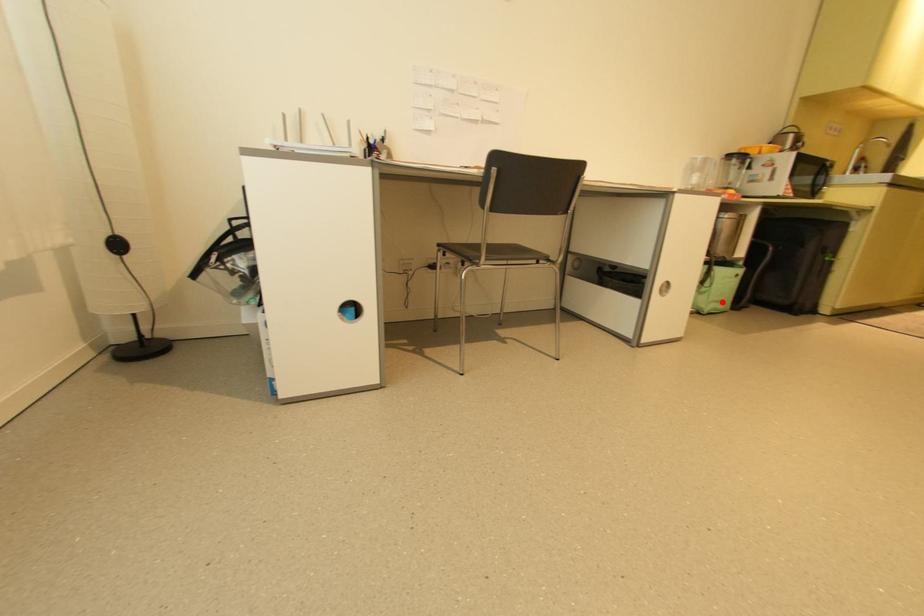
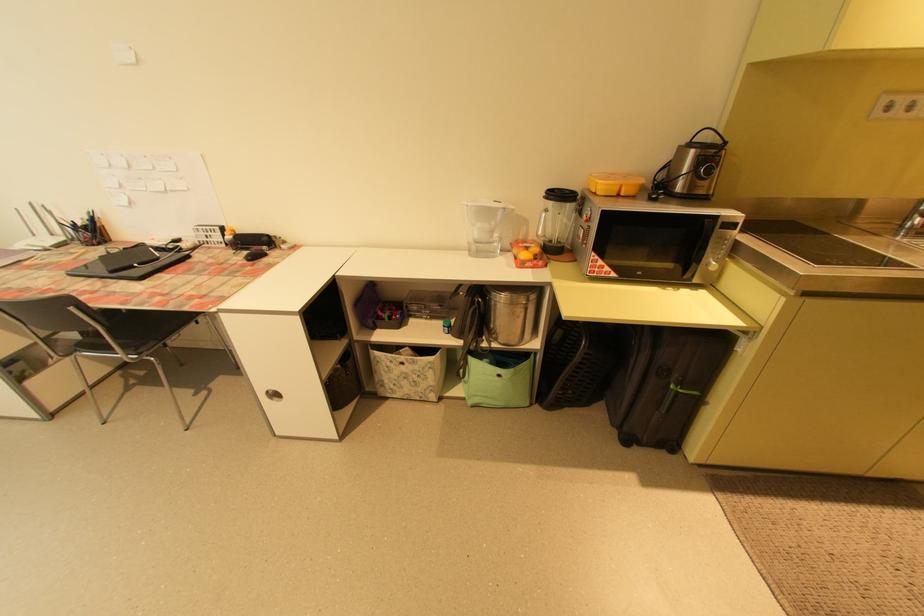
Question: I am providing you with two images of the same scene from different viewpoints. In image1, a red point is highlighted. Considering the same 3D point in image2, which of the following is correct?

Choices:
 (A) It is closer
 (B) It is farther

Answer: (B)